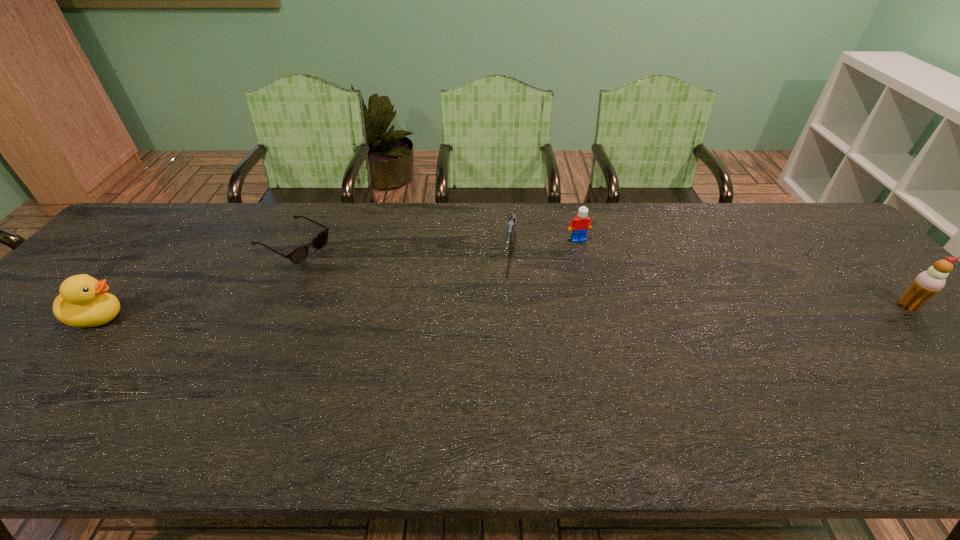
Identify the location of Lego at the far edge. (581, 223).

Where is `object at the left edge`? The image size is (960, 540). object at the left edge is located at coordinates [83, 302].

Find the location of a particular element. The image size is (960, 540). object that is at the right edge is located at coordinates (928, 283).

In the image, there is a desktop. In order to click on free region at the far edge in this screenshot , I will do `click(689, 220)`.

Image resolution: width=960 pixels, height=540 pixels. In the image, there is a desktop. Find the location of `vacant area at the near edge`. vacant area at the near edge is located at coordinates (294, 377).

Identify the location of free region at the left edge of the desktop. The width and height of the screenshot is (960, 540). (125, 293).

In the image, there is a desktop. Identify the location of vacant space at the right edge. This screenshot has width=960, height=540. (882, 328).

Find the location of a particular element. vacant area at the far left corner of the desktop is located at coordinates (163, 224).

What are the coordinates of `free space at the near right corner` in the screenshot? It's located at (905, 378).

Where is `free space between the Lego and the third object from left to right`? free space between the Lego and the third object from left to right is located at coordinates (544, 246).